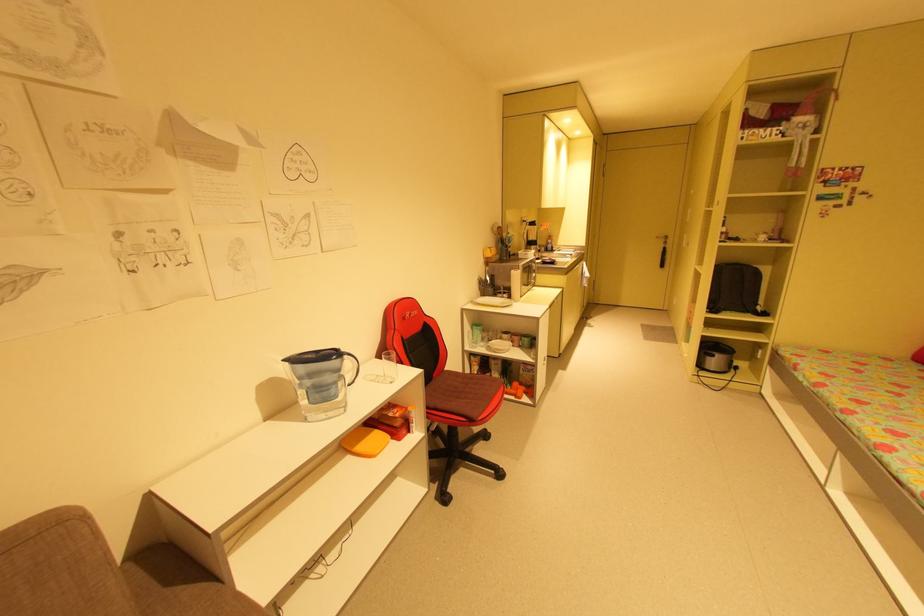
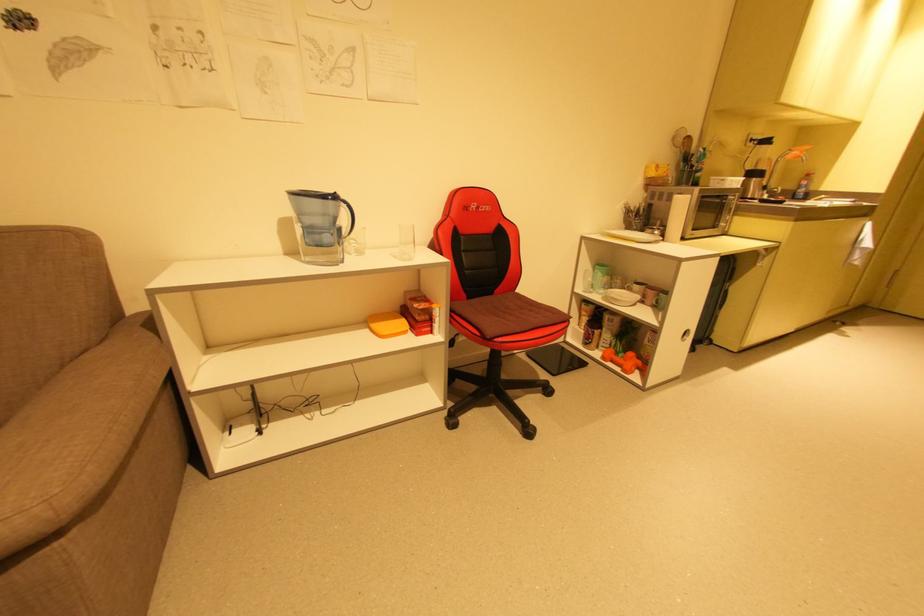
Question: The camera is either moving clockwise (left) or counter-clockwise (right) around the object. The first image is from the beginning of the video and the second image is from the end. Is the camera moving left or right when shooting the video?

Choices:
 (A) Left
 (B) Right

Answer: (B)